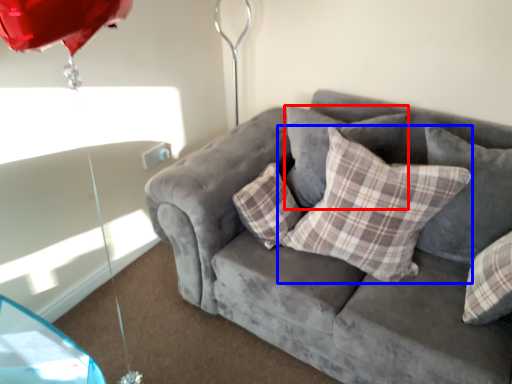
Question: Which point is further to the camera, pillow (highlighted by a red box) or pillow (highlighted by a blue box)?

Choices:
 (A) pillow
 (B) pillow

Answer: (A)